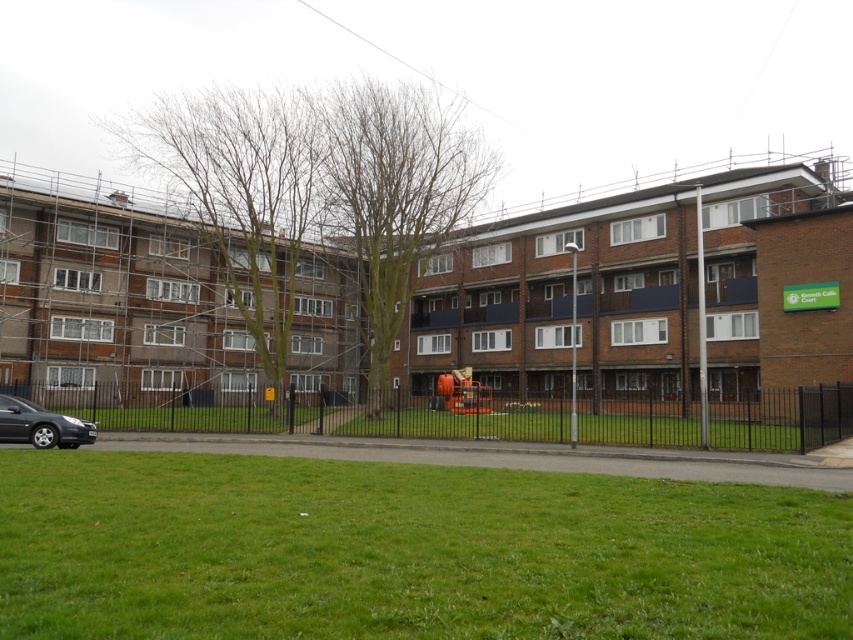
Does green grass at lower center have a greater width compared to green grass at center?

No.

Does green grass at lower center appear under green grass at center?

No.

Identify the location of green grass at lower center. (405, 552).

Is green grass at lower center below matte black car at lower left?

Incorrect, green grass at lower center is not positioned below matte black car at lower left.

Can you confirm if green grass at lower center is positioned to the left of matte black car at lower left?

In fact, green grass at lower center is to the right of matte black car at lower left.

The image size is (853, 640). Find the location of `green grass at lower center`. green grass at lower center is located at coordinates (405, 552).

Can you confirm if green grass at center is bigger than matte black car at lower left?

Correct, green grass at center is larger in size than matte black car at lower left.

Between green grass at center and matte black car at lower left, which one appears on the left side from the viewer's perspective?

From the viewer's perspective, matte black car at lower left appears more on the left side.

What do you see at coordinates (462, 424) in the screenshot? The height and width of the screenshot is (640, 853). I see `green grass at center` at bounding box center [462, 424].

Find the location of a particular element. green grass at center is located at coordinates (462, 424).